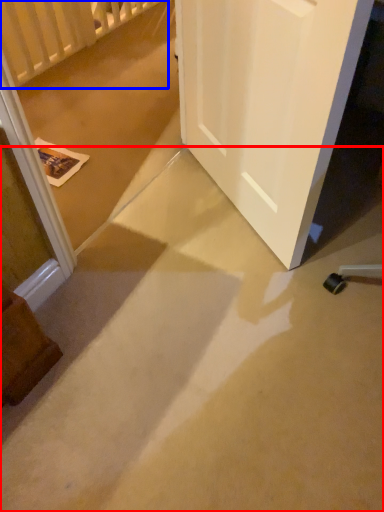
Question: Which object is closer to the camera taking this photo, concrete (highlighted by a red box) or balustrade (highlighted by a blue box)?

Choices:
 (A) concrete
 (B) balustrade

Answer: (A)